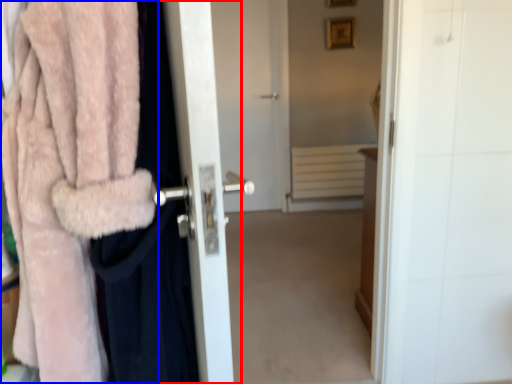
Question: Which of the following is the farthest to the observer, screen door (highlighted by a red box) or towel (highlighted by a blue box)?

Choices:
 (A) screen door
 (B) towel

Answer: (A)